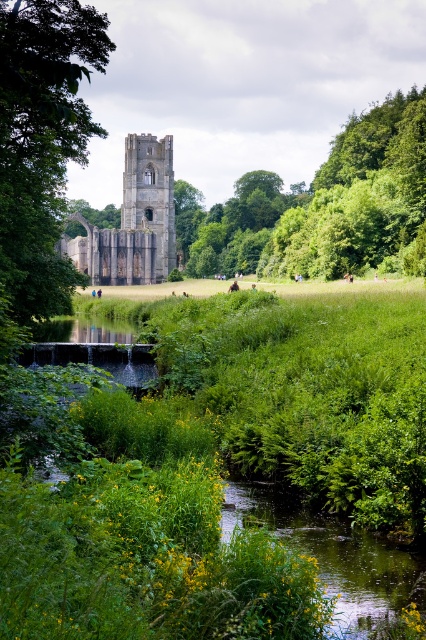
Can you confirm if green leafy water at lower center is positioned to the left of stone tower at center?

In fact, green leafy water at lower center is to the right of stone tower at center.

Which of these two, green leafy water at lower center or stone tower at center, stands shorter?

With less height is green leafy water at lower center.

Where is `green leafy water at lower center`? Image resolution: width=426 pixels, height=640 pixels. green leafy water at lower center is located at coordinates (336, 557).

Can you confirm if green leafy tree at upper left is thinner than dark gray stone tower at center?

In fact, green leafy tree at upper left might be wider than dark gray stone tower at center.

Between point (19, 51) and point (135, 160), which one is positioned in front?

Point (19, 51)

Is point (23, 230) less distant than point (166, 173)?

Yes.

Locate an element on the screen. green leafy tree at upper left is located at coordinates (42, 141).

Identify the location of green leafy water at lower center. (336, 557).

Does green leafy water at lower center appear over dark gray stone tower at center?

No.

Image resolution: width=426 pixels, height=640 pixels. I want to click on green leafy water at lower center, so click(x=336, y=557).

Identify the location of green leafy water at lower center. This screenshot has height=640, width=426. (336, 557).